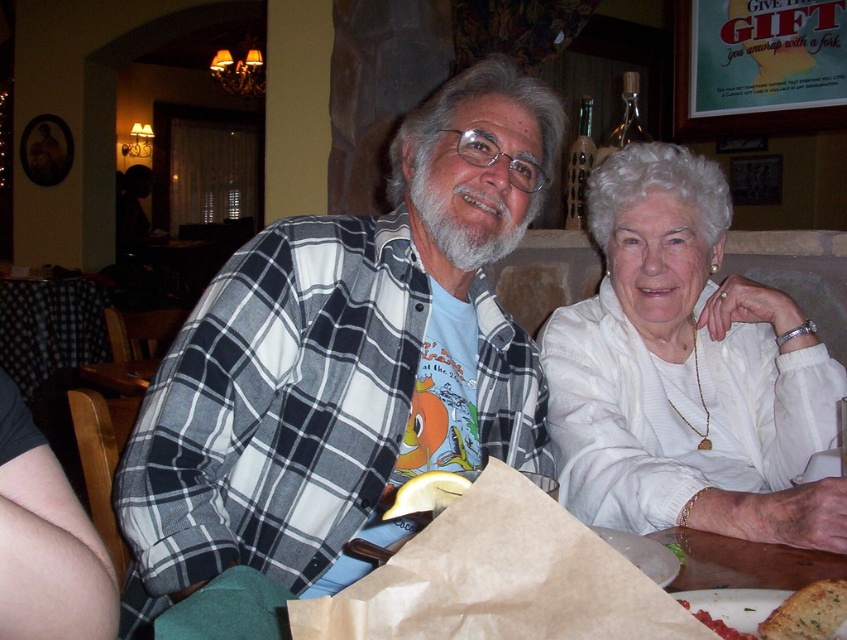
Question: Is brown paper bag at lower center to the left of white crumbly bread at lower right from the viewer's perspective?

Choices:
 (A) yes
 (B) no

Answer: (A)

Question: In this image, where is brown paper bag at lower center located relative to white crumbly bread at lower right?

Choices:
 (A) right
 (B) left

Answer: (B)

Question: Which point appears farthest from the camera in this image?

Choices:
 (A) (773, 442)
 (B) (319, 388)

Answer: (A)

Question: Among these objects, which one is nearest to the camera?

Choices:
 (A) yellow rubbery lemon at center
 (B) white satin blouse at upper right

Answer: (A)

Question: Which point is closer to the camera?

Choices:
 (A) plaid flannel shirt at center
 (B) white crumbly bread at lower right

Answer: (B)

Question: Can you confirm if plaid flannel shirt at center is positioned to the right of white satin blouse at upper right?

Choices:
 (A) yes
 (B) no

Answer: (B)